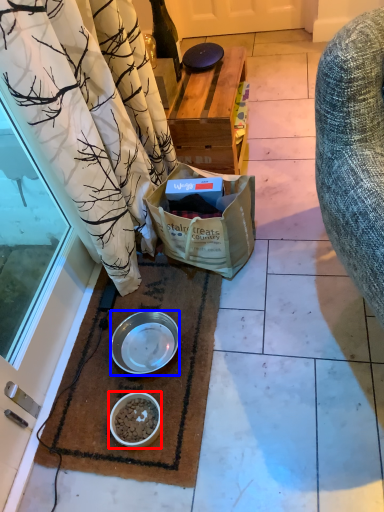
Question: Which point is closer to the camera, bowl (highlighted by a red box) or bowl (highlighted by a blue box)?

Choices:
 (A) bowl
 (B) bowl

Answer: (A)